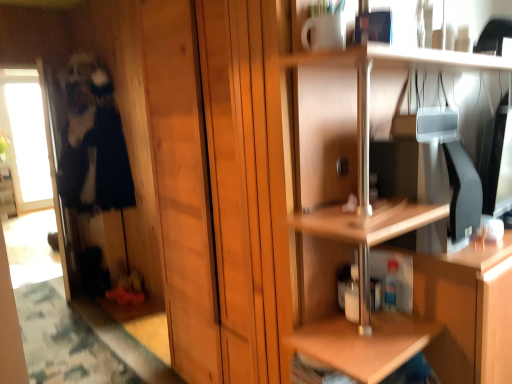
The height and width of the screenshot is (384, 512). Find the location of `free space in front of transparent glass screen door at left`. free space in front of transparent glass screen door at left is located at coordinates (63, 302).